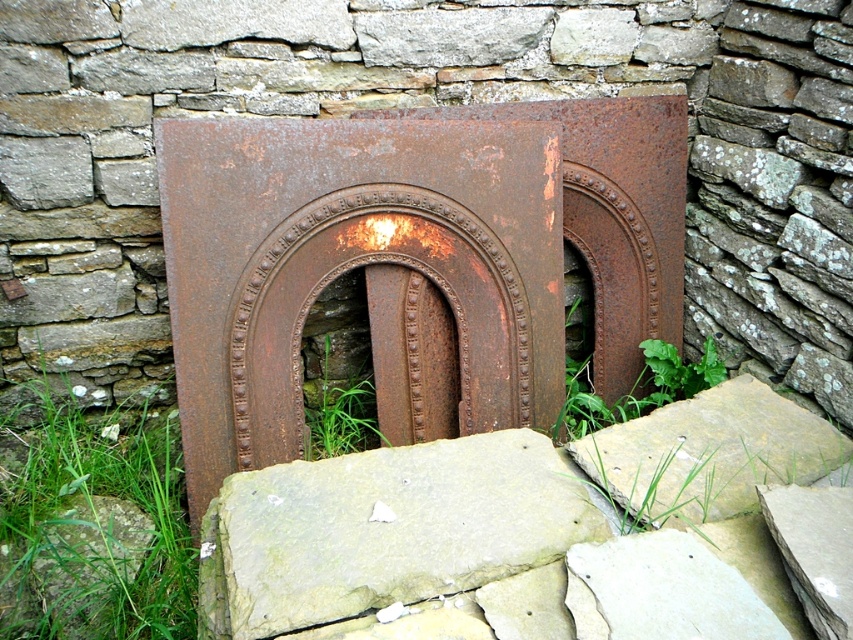
Is green grass at lower left above green grass at center?

Incorrect, green grass at lower left is not positioned above green grass at center.

I want to click on green grass at lower left, so (94, 531).